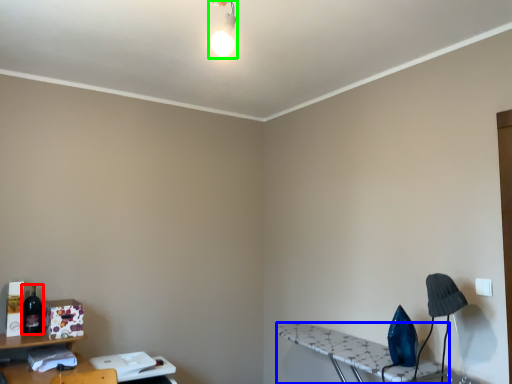
Question: Based on their relative distances, which object is farther from bottle (highlighted by a red box)? Choose from table (highlighted by a blue box) and light fixture (highlighted by a green box).

Choices:
 (A) table
 (B) light fixture

Answer: (B)